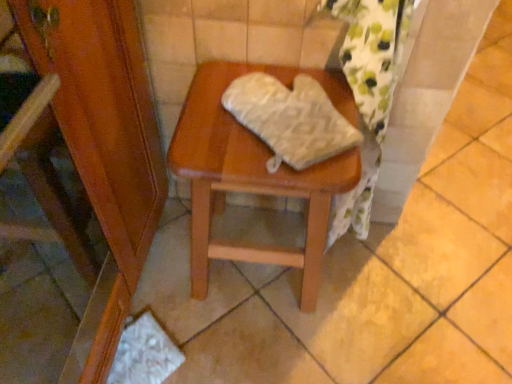
Identify the location of free space above white textured oven mitt at center (from a real-world perspective). (278, 103).